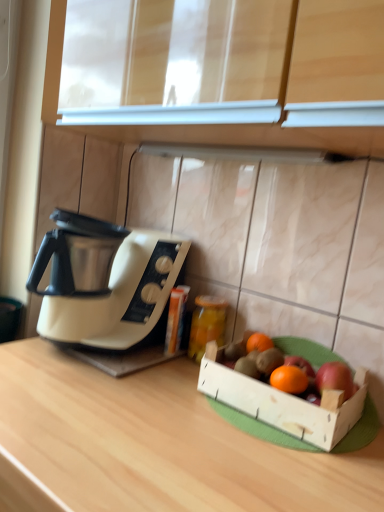
You are a GUI agent. You are given a task and a screenshot of the screen. Output one action in this format:
    pyautogui.click(x=<x>, y=<y>)
    Task: Click on the free spot in front of wooden crate at right
    The image size is (384, 512).
    Given the screenshot: What is the action you would take?
    click(x=263, y=471)